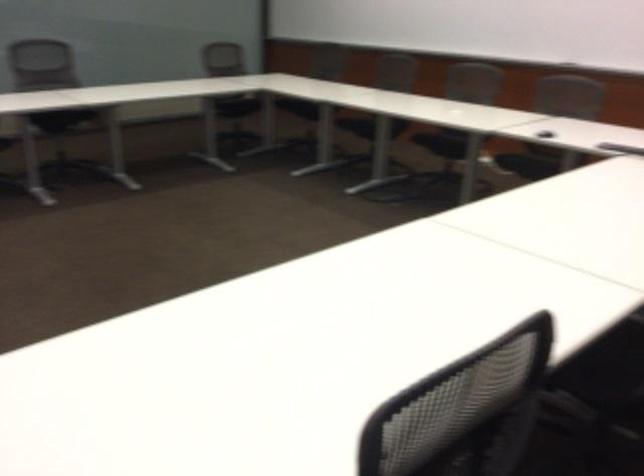
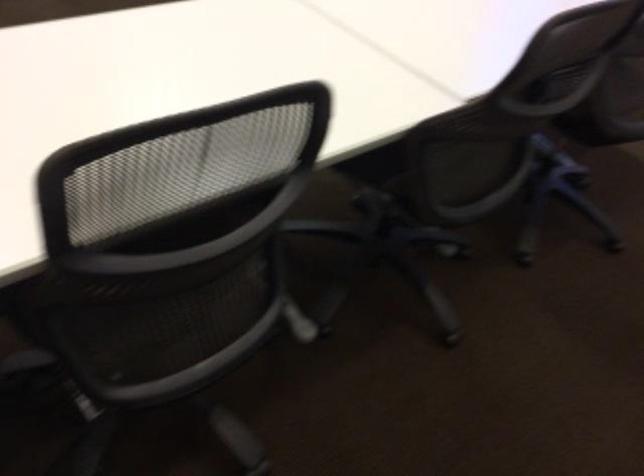
The images are taken continuously from a first-person perspective. In which direction is your viewpoint rotating?

The rotation direction of the camera is right-down.